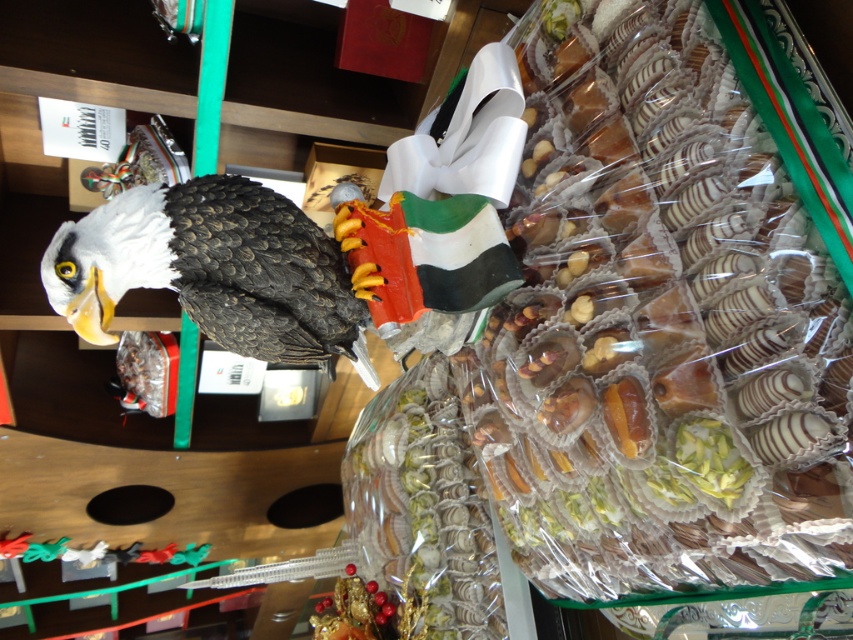
Is translucent plastic confections at right to the right of shiny black eagle at left from the viewer's perspective?

Yes, translucent plastic confections at right is to the right of shiny black eagle at left.

Who is positioned more to the left, translucent plastic confections at right or shiny black eagle at left?

shiny black eagle at left is more to the left.

Where is `translucent plastic confections at right`? The height and width of the screenshot is (640, 853). translucent plastic confections at right is located at coordinates (663, 320).